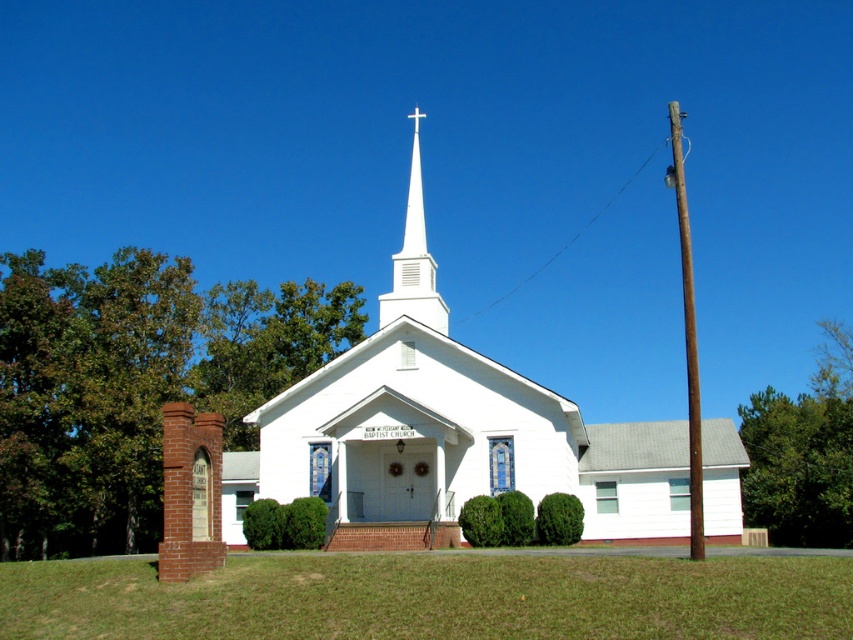
What do you see at coordinates (445, 432) in the screenshot? I see `white matte church at center` at bounding box center [445, 432].

Does point (457, 426) come in front of point (695, 380)?

That is True.

At what (x,y) coordinates should I click in order to perform the action: click on white matte church at center. Please return your answer as a coordinate pair (x, y). Looking at the image, I should click on (445, 432).

Does white smooth steeple at center have a greater width compared to brown wooden pole at right?

In fact, white smooth steeple at center might be narrower than brown wooden pole at right.

Does point (410, 228) lie behind point (680, 186)?

No, (410, 228) is closer to viewer.

Who is more distant from viewer, (x=415, y=284) or (x=695, y=483)?

Point (x=415, y=284)

Locate an element on the screen. The image size is (853, 640). white smooth steeple at center is located at coordinates [x=415, y=259].

Between white matte church at center and white smooth steeple at center, which one has more height?

white matte church at center is taller.

Does point (416, 144) come farther from viewer compared to point (396, 276)?

Yes, point (416, 144) is farther from viewer.

Where is `white matte church at center`? white matte church at center is located at coordinates (445, 432).

Find the location of a particular element. white matte church at center is located at coordinates (445, 432).